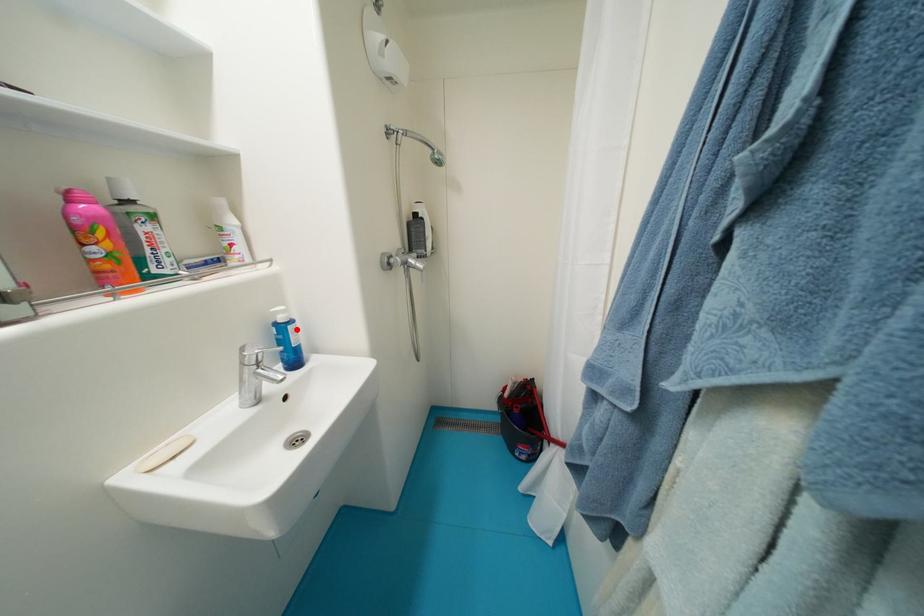
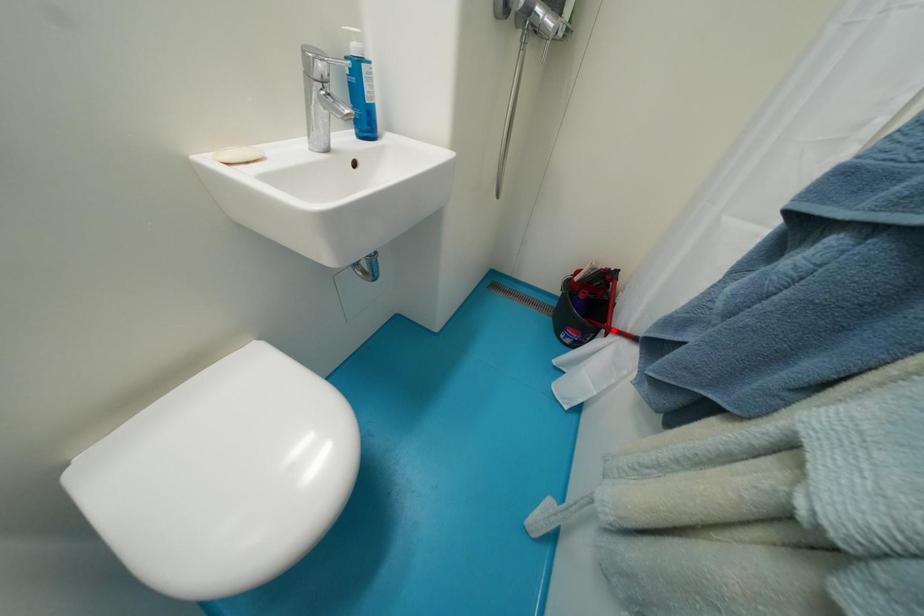
I am providing you with two images of the same scene from different viewpoints. A red point is marked on the first image and another point is marked on the second image. Are the points marked in image1 and image2 representing the same 3D position?

No